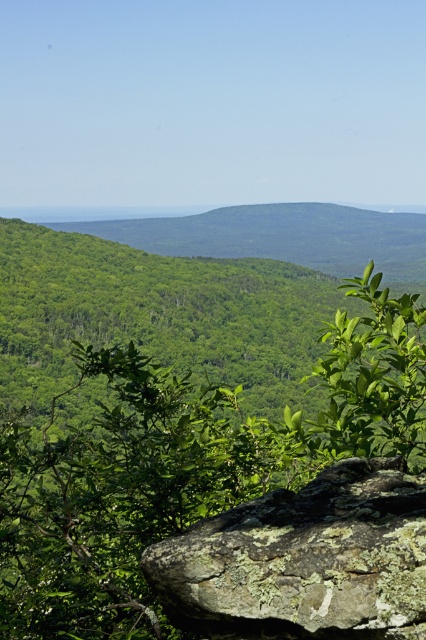
Does point (336, 422) come closer to viewer compared to point (383, 456)?

That is False.

Is green leafy tree at center above lichen-covered rock at center?

Correct, green leafy tree at center is located above lichen-covered rock at center.

I want to click on green leafy tree at center, so click(x=166, y=412).